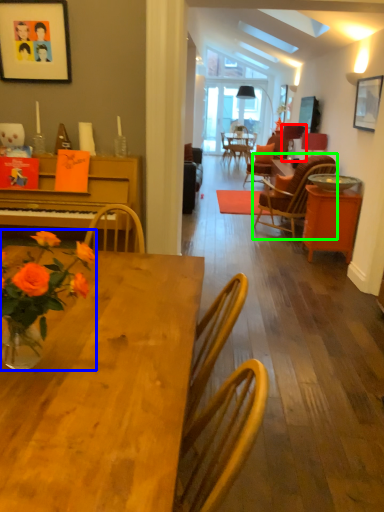
Question: Which is farther away from lamp (highlighted by a red box)? flower (highlighted by a blue box) or chair (highlighted by a green box)?

Choices:
 (A) flower
 (B) chair

Answer: (A)